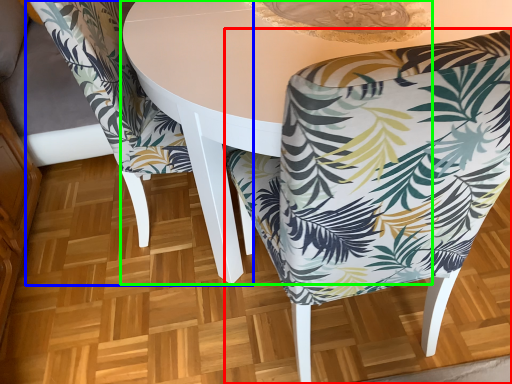
Question: Considering the real-world distances, which object is farthest from chair (highlighted by a red box)? chair (highlighted by a blue box) or round table (highlighted by a green box)?

Choices:
 (A) chair
 (B) round table

Answer: (A)